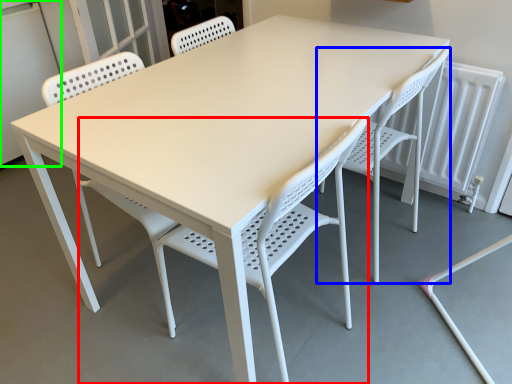
Question: Estimate the real-world distances between objects in this image. Which object is farther from chair (highlighted by a red box), chair (highlighted by a blue box) or screen door (highlighted by a green box)?

Choices:
 (A) chair
 (B) screen door

Answer: (B)